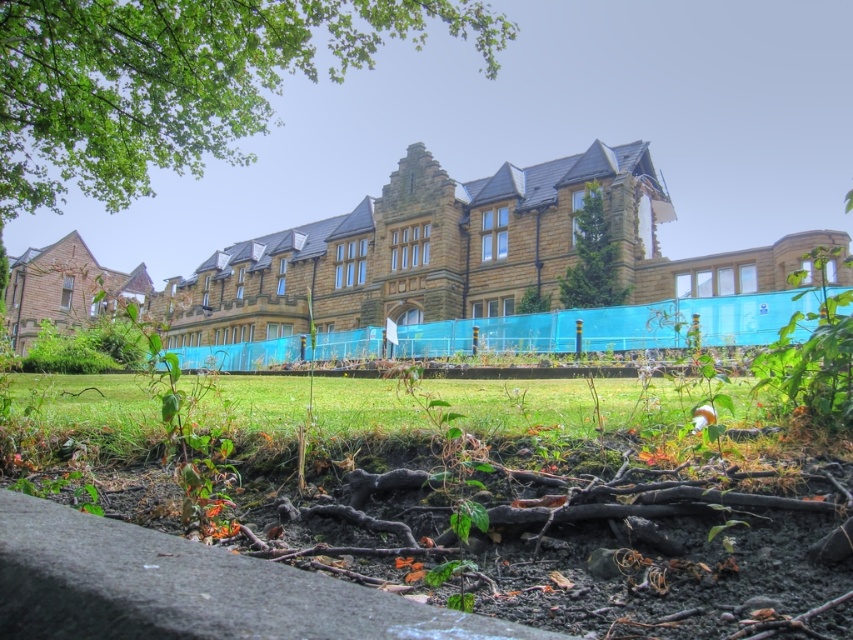
In the scene shown: Is green leafy tree at upper left bigger than green textured tree at center?

Correct, green leafy tree at upper left is larger in size than green textured tree at center.

Where is `green leafy tree at upper left`? green leafy tree at upper left is located at coordinates (177, 81).

Is point (271, 115) farther from viewer compared to point (566, 301)?

Yes.

Image resolution: width=853 pixels, height=640 pixels. In order to click on green leafy tree at upper left in this screenshot , I will do `click(177, 81)`.